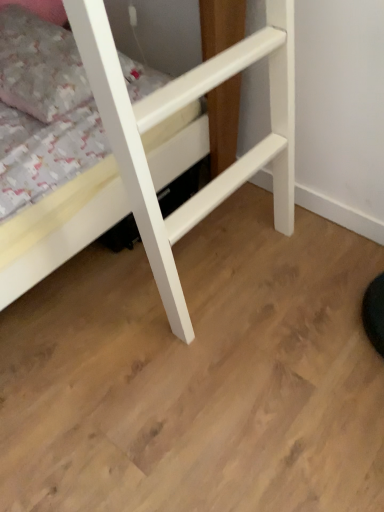
From the picture: Measure the distance between point (x=21, y=15) and camera.

4.57 feet.

What do you see at coordinates (39, 66) in the screenshot?
I see `fluffy white pillow at upper left` at bounding box center [39, 66].

Where is `fluffy white pillow at upper left`? The height and width of the screenshot is (512, 384). fluffy white pillow at upper left is located at coordinates (39, 66).

Identify the location of fluffy white pillow at upper left. This screenshot has height=512, width=384. (39, 66).